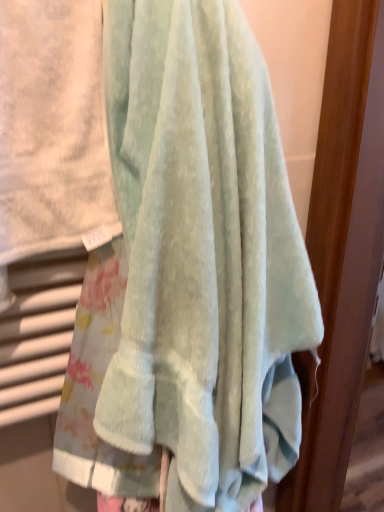
The image size is (384, 512). Describe the element at coordinates (203, 255) in the screenshot. I see `light blue cotton towel at center, the 2th towel when ordered from left to right` at that location.

In order to click on light blue cotton towel at center, the 2th towel when ordered from left to right in this screenshot , I will do `click(203, 255)`.

This screenshot has width=384, height=512. What are the coordinates of `sage green towel at center, which is the 2th towel in right-to-left order` in the screenshot? It's located at (52, 127).

The width and height of the screenshot is (384, 512). What do you see at coordinates (52, 127) in the screenshot?
I see `sage green towel at center, which is the 2th towel in right-to-left order` at bounding box center [52, 127].

Find the location of a particular element. The image size is (384, 512). light blue cotton towel at center, the 2th towel when ordered from left to right is located at coordinates (203, 255).

Is light blue cotton towel at center, the 1th towel from the right, at the left side of sage green towel at center, which is the 2th towel in right-to-left order?

No.

Who is more distant, light blue cotton towel at center, the 2th towel when ordered from left to right, or sage green towel at center, placed as the 1th towel when sorted from left to right?

light blue cotton towel at center, the 2th towel when ordered from left to right, is behind.

Which is in front, point (170, 78) or point (79, 16)?

The point (170, 78) is more forward.

Based on the photo, from the image's perspective, does light blue cotton towel at center, the 2th towel when ordered from left to right, appear lower than sage green towel at center, placed as the 1th towel when sorted from left to right?

Yes, from the image's perspective, light blue cotton towel at center, the 2th towel when ordered from left to right, is beneath sage green towel at center, placed as the 1th towel when sorted from left to right.

From a real-world perspective, is light blue cotton towel at center, the 2th towel when ordered from left to right, above or below sage green towel at center, placed as the 1th towel when sorted from left to right?

Clearly, from a real-world perspective, light blue cotton towel at center, the 2th towel when ordered from left to right, is below sage green towel at center, placed as the 1th towel when sorted from left to right.

Does light blue cotton towel at center, the 2th towel when ordered from left to right, have a lesser width compared to sage green towel at center, which is the 2th towel in right-to-left order?

In fact, light blue cotton towel at center, the 2th towel when ordered from left to right, might be wider than sage green towel at center, which is the 2th towel in right-to-left order.

Does light blue cotton towel at center, the 2th towel when ordered from left to right, have a lesser height compared to sage green towel at center, placed as the 1th towel when sorted from left to right?

No, light blue cotton towel at center, the 2th towel when ordered from left to right, is not shorter than sage green towel at center, placed as the 1th towel when sorted from left to right.

Can you confirm if light blue cotton towel at center, the 1th towel from the right, is bigger than sage green towel at center, placed as the 1th towel when sorted from left to right?

Indeed, light blue cotton towel at center, the 1th towel from the right, has a larger size compared to sage green towel at center, placed as the 1th towel when sorted from left to right.

Does light blue cotton towel at center, the 2th towel when ordered from left to right, contain sage green towel at center, placed as the 1th towel when sorted from left to right?

Yes, light blue cotton towel at center, the 2th towel when ordered from left to right, contains sage green towel at center, placed as the 1th towel when sorted from left to right.

Are light blue cotton towel at center, the 2th towel when ordered from left to right, and sage green towel at center, which is the 2th towel in right-to-left order, located far from each other?

They are positioned close to each other.

Is light blue cotton towel at center, the 2th towel when ordered from left to right, facing away from sage green towel at center, placed as the 1th towel when sorted from left to right?

No, light blue cotton towel at center, the 2th towel when ordered from left to right, is not facing the opposite direction of sage green towel at center, placed as the 1th towel when sorted from left to right.

How far apart are light blue cotton towel at center, the 1th towel from the right, and sage green towel at center, placed as the 1th towel when sorted from left to right?

light blue cotton towel at center, the 1th towel from the right, and sage green towel at center, placed as the 1th towel when sorted from left to right, are 7.22 inches apart from each other.

Identify the location of towel below the sage green towel at center, placed as the 1th towel when sorted from left to right (from the image's perspective). (203, 255).

Which object is positioned more to the right, sage green towel at center, placed as the 1th towel when sorted from left to right, or light blue cotton towel at center, the 2th towel when ordered from left to right?

From the viewer's perspective, light blue cotton towel at center, the 2th towel when ordered from left to right, appears more on the right side.

Relative to light blue cotton towel at center, the 1th towel from the right, is sage green towel at center, placed as the 1th towel when sorted from left to right, in front or behind?

sage green towel at center, placed as the 1th towel when sorted from left to right, is positioned closer to the viewer than light blue cotton towel at center, the 1th towel from the right.

Does point (112, 207) appear closer or farther from the camera than point (250, 101)?

Point (112, 207) is positioned farther from the camera compared to point (250, 101).

From the image's perspective, is sage green towel at center, which is the 2th towel in right-to-left order, above or below light blue cotton towel at center, the 2th towel when ordered from left to right?

sage green towel at center, which is the 2th towel in right-to-left order, is situated higher than light blue cotton towel at center, the 2th towel when ordered from left to right, in the image.

From a real-world perspective, is sage green towel at center, which is the 2th towel in right-to-left order, physically above light blue cotton towel at center, the 2th towel when ordered from left to right?

Yes.

Looking at their sizes, would you say sage green towel at center, placed as the 1th towel when sorted from left to right, is wider or thinner than light blue cotton towel at center, the 1th towel from the right?

Considering their sizes, sage green towel at center, placed as the 1th towel when sorted from left to right, looks slimmer than light blue cotton towel at center, the 1th towel from the right.

Which of these two, sage green towel at center, which is the 2th towel in right-to-left order, or light blue cotton towel at center, the 1th towel from the right, stands taller?

light blue cotton towel at center, the 1th towel from the right.

Considering the sizes of objects sage green towel at center, placed as the 1th towel when sorted from left to right, and light blue cotton towel at center, the 2th towel when ordered from left to right, in the image provided, who is bigger, sage green towel at center, placed as the 1th towel when sorted from left to right, or light blue cotton towel at center, the 2th towel when ordered from left to right,?

Bigger between the two is light blue cotton towel at center, the 2th towel when ordered from left to right.

Is sage green towel at center, which is the 2th towel in right-to-left order, completely or partially outside of light blue cotton towel at center, the 1th towel from the right?

No.

Is sage green towel at center, which is the 2th towel in right-to-left order, far away from light blue cotton towel at center, the 2th towel when ordered from left to right?

No.

Is sage green towel at center, placed as the 1th towel when sorted from left to right, oriented away from light blue cotton towel at center, the 2th towel when ordered from left to right?

No, sage green towel at center, placed as the 1th towel when sorted from left to right, is not facing the opposite direction of light blue cotton towel at center, the 2th towel when ordered from left to right.

Locate an element on the screen. The width and height of the screenshot is (384, 512). towel in front of the light blue cotton towel at center, the 1th towel from the right is located at coordinates (52, 127).

Locate an element on the screen. towel above the light blue cotton towel at center, the 2th towel when ordered from left to right (from a real-world perspective) is located at coordinates (52, 127).

Where is `towel that is in front of the light blue cotton towel at center, the 1th towel from the right`? This screenshot has width=384, height=512. towel that is in front of the light blue cotton towel at center, the 1th towel from the right is located at coordinates (52, 127).